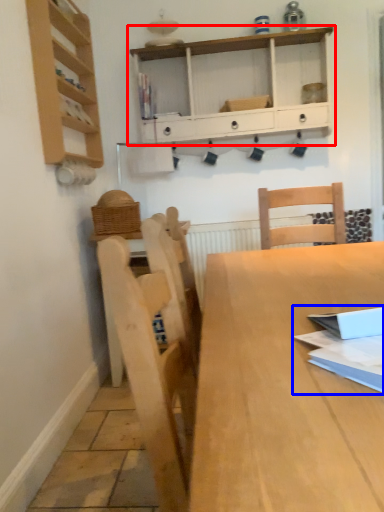
Question: Among these objects, which one is farthest to the camera, shelf (highlighted by a red box) or book (highlighted by a blue box)?

Choices:
 (A) shelf
 (B) book

Answer: (A)